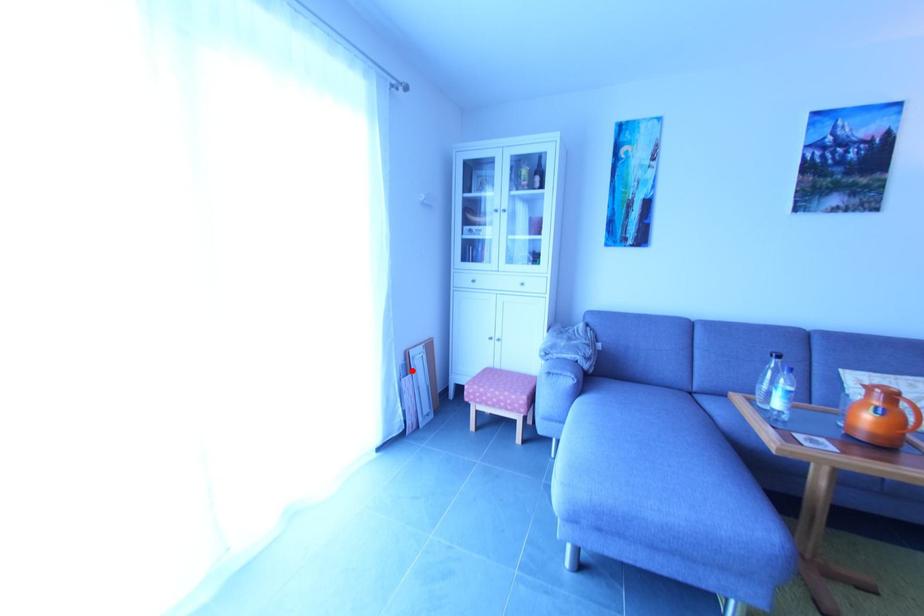
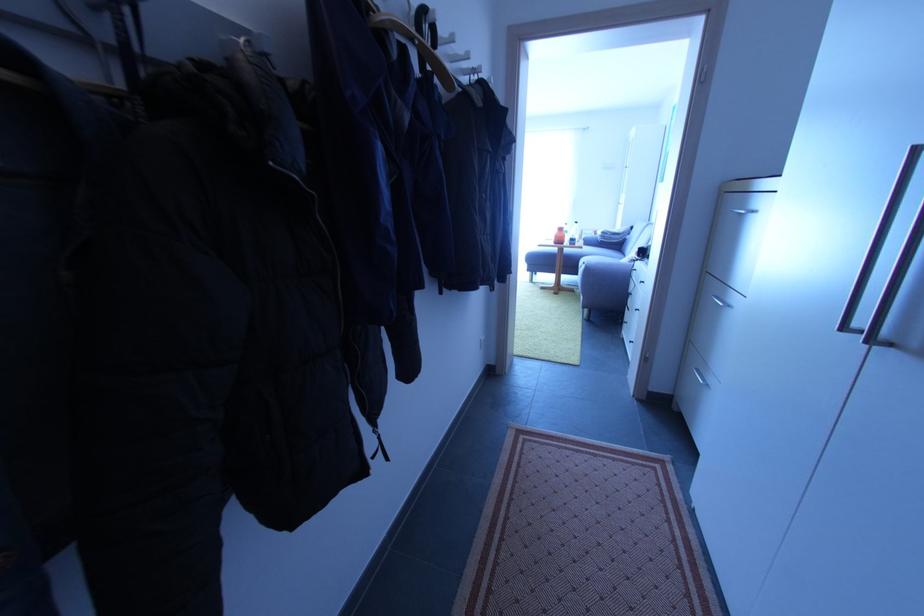
In the second image, find the point that corresponds to the highlighted location in the first image.

(585, 238)